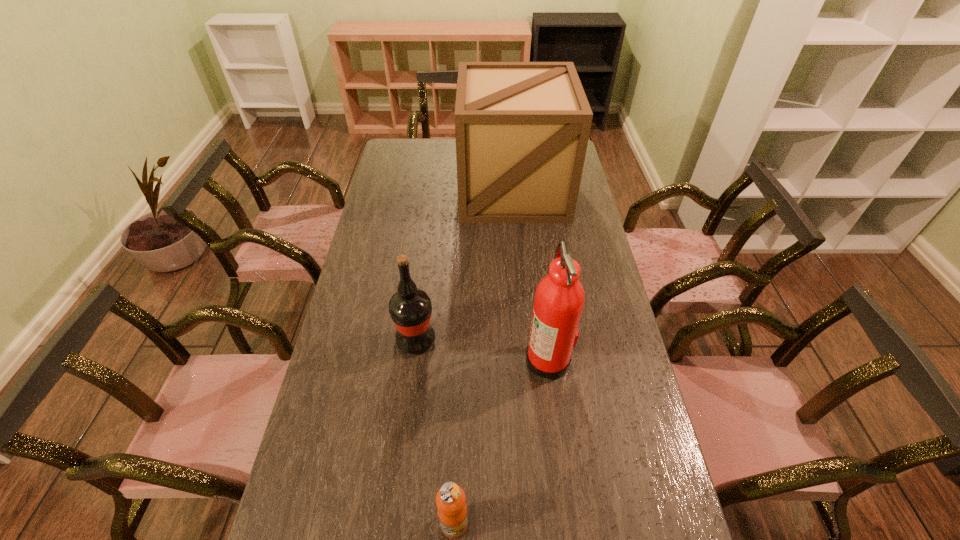
Identify the location of free location located on the left of the leftmost object. This screenshot has width=960, height=540. (364, 340).

This screenshot has width=960, height=540. In order to click on vacant space located on the back of the fruit juice in this screenshot , I will do `click(460, 369)`.

Where is `object present at the far edge`? This screenshot has height=540, width=960. object present at the far edge is located at coordinates (522, 128).

Find the location of a particular element. This screenshot has width=960, height=540. object present at the right edge is located at coordinates (522, 128).

Identify the location of object located in the far right corner section of the desktop. (522, 128).

The width and height of the screenshot is (960, 540). In the image, there is a desktop. What are the coordinates of `vacant space at the left edge` in the screenshot? It's located at (405, 213).

In the image, there is a desktop. In order to click on vacant space at the right edge in this screenshot , I will do `click(608, 300)`.

Where is `free space between the nearest object and the box`? free space between the nearest object and the box is located at coordinates (484, 356).

Where is `free space between the second shortest object and the fire extinguisher`? Image resolution: width=960 pixels, height=540 pixels. free space between the second shortest object and the fire extinguisher is located at coordinates (482, 349).

Where is `unoccupied position between the box and the fire extinguisher`? unoccupied position between the box and the fire extinguisher is located at coordinates [531, 274].